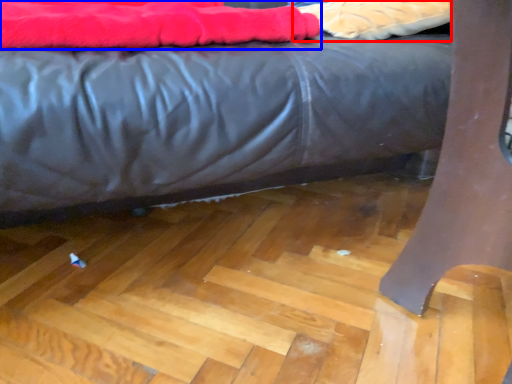
Question: Which point is further to the camera, material (highlighted by a red box) or blanket (highlighted by a blue box)?

Choices:
 (A) material
 (B) blanket

Answer: (A)